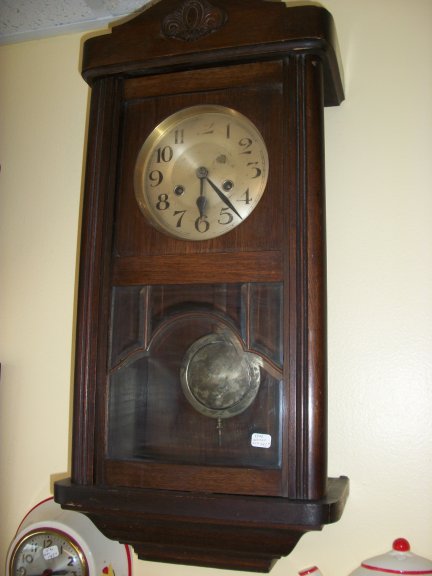
I want to click on extra clock, so click(x=96, y=532), click(x=48, y=515), click(x=389, y=562).